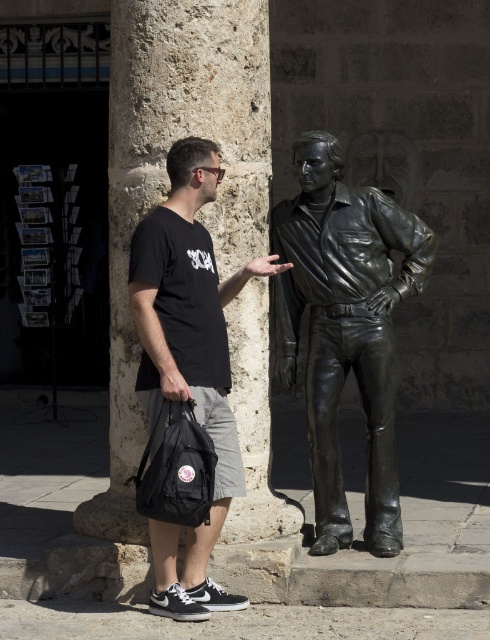
From the picture: Can you confirm if bronze statue at center is shorter than black matte t-shirt at center?

Yes, bronze statue at center is shorter than black matte t-shirt at center.

In the scene shown: Does bronze statue at center appear on the right side of black matte t-shirt at center?

Yes, bronze statue at center is to the right of black matte t-shirt at center.

Between point (342, 381) and point (220, 396), which one is positioned behind?

Point (342, 381)

Locate an element on the screen. bronze statue at center is located at coordinates point(345,328).